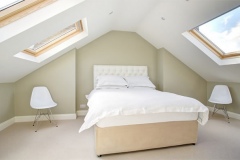
Locate an element on the screen. outlet is located at coordinates (80, 105).